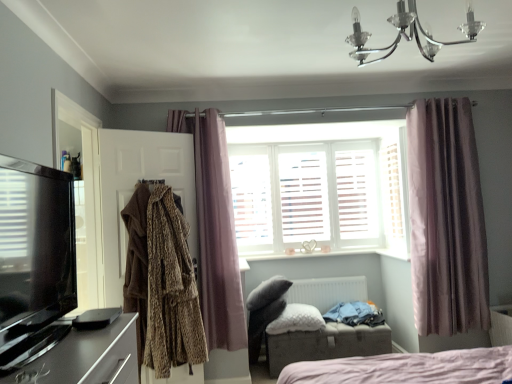
Question: Is white wooden shutters at center looking in the opposite direction of white fluffy pillow at center?

Choices:
 (A) no
 (B) yes

Answer: (A)

Question: Is white wooden shutters at center shorter than white fluffy pillow at center?

Choices:
 (A) no
 (B) yes

Answer: (A)

Question: From a real-world perspective, is white wooden shutters at center on white fluffy pillow at center?

Choices:
 (A) yes
 (B) no

Answer: (A)

Question: Is the depth of white wooden shutters at center greater than that of white fluffy pillow at center?

Choices:
 (A) yes
 (B) no

Answer: (A)

Question: From the image's perspective, would you say white wooden shutters at center is shown under white fluffy pillow at center?

Choices:
 (A) no
 (B) yes

Answer: (A)

Question: Does white wooden shutters at center have a lesser width compared to white fluffy pillow at center?

Choices:
 (A) yes
 (B) no

Answer: (A)

Question: Would you say brown textured coat at left, which appears as the first clothing when viewed from the front, contains white wooden shutters at center?

Choices:
 (A) yes
 (B) no

Answer: (B)

Question: Is the position of brown textured coat at left, which appears as the first clothing when viewed from the front, more distant than that of white wooden shutters at center?

Choices:
 (A) yes
 (B) no

Answer: (B)

Question: From the image's perspective, does brown textured coat at left, placed as the second clothing when sorted from back to front, appear lower than white wooden shutters at center?

Choices:
 (A) no
 (B) yes

Answer: (B)

Question: Does brown textured coat at left, which is counted as the first clothing, starting from the top, come in front of white wooden shutters at center?

Choices:
 (A) no
 (B) yes

Answer: (B)

Question: Does brown textured coat at left, placed as the second clothing when sorted from back to front, appear on the left side of white wooden shutters at center?

Choices:
 (A) no
 (B) yes

Answer: (B)

Question: Is brown textured coat at left, placed as the second clothing when sorted from back to front, oriented away from white wooden shutters at center?

Choices:
 (A) no
 (B) yes

Answer: (A)

Question: Is brown textured coat at left, which is counted as the first clothing, starting from the top, wider than white matte radiator at center?

Choices:
 (A) yes
 (B) no

Answer: (A)